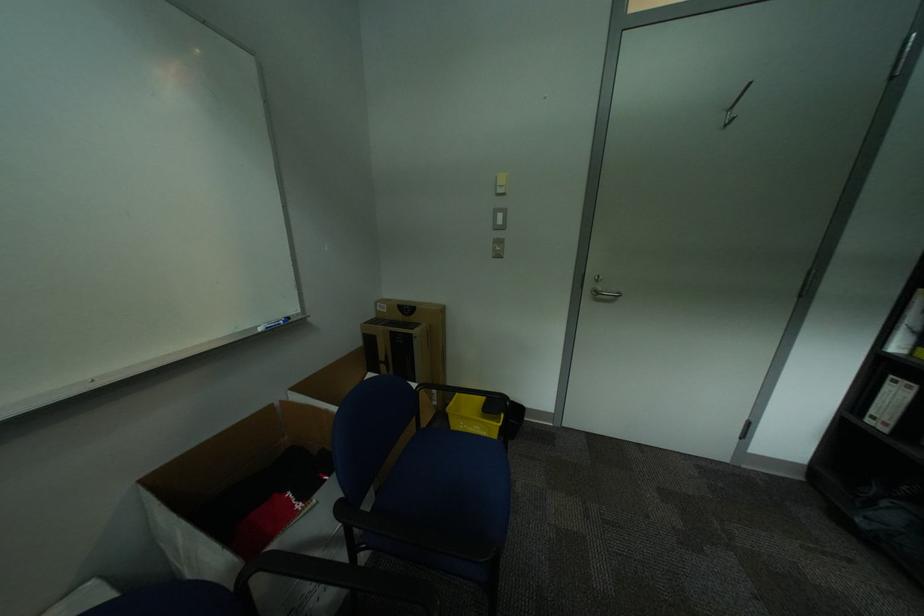
The height and width of the screenshot is (616, 924). Describe the element at coordinates (603, 294) in the screenshot. I see `the silver door handle` at that location.